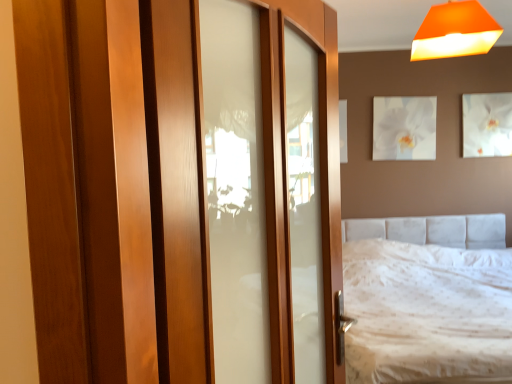
What do you see at coordinates (487, 124) in the screenshot? I see `white glossy picture frame at upper right, marked as the first picture frame in a right-to-left arrangement` at bounding box center [487, 124].

Locate an element on the screen. The width and height of the screenshot is (512, 384). white glossy picture frame at upper right, marked as the first picture frame in a right-to-left arrangement is located at coordinates (487, 124).

Describe the element at coordinates (115, 189) in the screenshot. The width and height of the screenshot is (512, 384). I see `wooden door at center` at that location.

What are the coordinates of `white glossy picture frame at upper center, the 1th picture frame when ordered from left to right` in the screenshot? It's located at (404, 128).

Which of these two, white textured bed at center or wooden door at center, is bigger?

white textured bed at center.

Is white textured bed at center far from wooden door at center?

That's right, there is a large distance between white textured bed at center and wooden door at center.

Does white textured bed at center have a greater height compared to wooden door at center?

Incorrect, the height of white textured bed at center is not larger of that of wooden door at center.

Between white textured bed at center and wooden door at center, which one has larger width?

With larger width is white textured bed at center.

Is white glossy picture frame at upper center, placed as the 2th picture frame when sorted from right to left, surrounded by orange matte lampshade at upper right?

No, orange matte lampshade at upper right does not contain white glossy picture frame at upper center, placed as the 2th picture frame when sorted from right to left.

In the scene shown: Is orange matte lampshade at upper right beside white glossy picture frame at upper center, placed as the 2th picture frame when sorted from right to left?

No, orange matte lampshade at upper right is not with white glossy picture frame at upper center, placed as the 2th picture frame when sorted from right to left.

Does orange matte lampshade at upper right have a lesser height compared to white glossy picture frame at upper center, placed as the 2th picture frame when sorted from right to left?

Correct, orange matte lampshade at upper right is not as tall as white glossy picture frame at upper center, placed as the 2th picture frame when sorted from right to left.

Which point is more distant from viewer, (431, 55) or (400, 117)?

The point (400, 117) is behind.

Which is closer, (382, 99) or (471, 27)?

Point (382, 99) is farther from the camera than point (471, 27).

From their relative heights in the image, would you say white glossy picture frame at upper center, placed as the 2th picture frame when sorted from right to left, is taller or shorter than orange matte lampshade at upper right?

white glossy picture frame at upper center, placed as the 2th picture frame when sorted from right to left, is taller than orange matte lampshade at upper right.

Is white glossy picture frame at upper center, the 1th picture frame when ordered from left to right, to the left or to the right of orange matte lampshade at upper right in the image?

In the image, white glossy picture frame at upper center, the 1th picture frame when ordered from left to right, appears on the right side of orange matte lampshade at upper right.

Can you confirm if white glossy picture frame at upper right, marked as the first picture frame in a right-to-left arrangement, is positioned to the right of orange matte lampshade at upper right?

Yes.

From the image's perspective, between white glossy picture frame at upper right, acting as the 2th picture frame starting from the left, and orange matte lampshade at upper right, which one is located above?

orange matte lampshade at upper right is shown above in the image.

Considering the positions of points (477, 146) and (458, 30), is point (477, 146) closer to camera compared to point (458, 30)?

No, it is not.

From a real-world perspective, is white glossy picture frame at upper right, acting as the 2th picture frame starting from the left, on orange matte lampshade at upper right?

Incorrect, from a real-world perspective, white glossy picture frame at upper right, acting as the 2th picture frame starting from the left, is lower than orange matte lampshade at upper right.

Is white glossy picture frame at upper right, acting as the 2th picture frame starting from the left, to the left of white textured bed at center from the viewer's perspective?

Incorrect, white glossy picture frame at upper right, acting as the 2th picture frame starting from the left, is not on the left side of white textured bed at center.

In the scene shown: Which is nearer, (465, 134) or (352, 265)?

Point (465, 134) is farther from the camera than point (352, 265).

Is the depth of white glossy picture frame at upper right, marked as the first picture frame in a right-to-left arrangement, less than that of white textured bed at center?

No, the depth of white glossy picture frame at upper right, marked as the first picture frame in a right-to-left arrangement, is greater than that of white textured bed at center.

Considering the sizes of white glossy picture frame at upper right, marked as the first picture frame in a right-to-left arrangement, and white textured bed at center in the image, is white glossy picture frame at upper right, marked as the first picture frame in a right-to-left arrangement, taller or shorter than white textured bed at center?

white glossy picture frame at upper right, marked as the first picture frame in a right-to-left arrangement, is shorter than white textured bed at center.

Between wooden door at center and white glossy picture frame at upper center, the 1th picture frame when ordered from left to right, which one has smaller size?

white glossy picture frame at upper center, the 1th picture frame when ordered from left to right, is smaller.

Looking at this image, is wooden door at center at the left side of white glossy picture frame at upper center, placed as the 2th picture frame when sorted from right to left?

Indeed, wooden door at center is positioned on the left side of white glossy picture frame at upper center, placed as the 2th picture frame when sorted from right to left.

From a real-world perspective, is wooden door at center physically located above or below white glossy picture frame at upper center, placed as the 2th picture frame when sorted from right to left?

Clearly, from a real-world perspective, wooden door at center is below white glossy picture frame at upper center, placed as the 2th picture frame when sorted from right to left.

Can you confirm if wooden door at center is taller than white glossy picture frame at upper center, placed as the 2th picture frame when sorted from right to left?

Correct, wooden door at center is much taller as white glossy picture frame at upper center, placed as the 2th picture frame when sorted from right to left.

Is orange matte lampshade at upper right directly adjacent to white glossy picture frame at upper right, acting as the 2th picture frame starting from the left?

They are not placed beside each other.

Could you measure the distance between orange matte lampshade at upper right and white glossy picture frame at upper right, acting as the 2th picture frame starting from the left?

orange matte lampshade at upper right is 6.40 feet away from white glossy picture frame at upper right, acting as the 2th picture frame starting from the left.

Can you confirm if orange matte lampshade at upper right is wider than white glossy picture frame at upper right, acting as the 2th picture frame starting from the left?

Indeed, orange matte lampshade at upper right has a greater width compared to white glossy picture frame at upper right, acting as the 2th picture frame starting from the left.

Who is smaller, orange matte lampshade at upper right or white glossy picture frame at upper right, marked as the first picture frame in a right-to-left arrangement?

Smaller between the two is white glossy picture frame at upper right, marked as the first picture frame in a right-to-left arrangement.

Locate an element on the screen. Image resolution: width=512 pixels, height=384 pixels. door located in front of the white textured bed at center is located at coordinates (115, 189).

I want to click on the 2nd picture frame behind when counting from the orange matte lampshade at upper right, so click(x=404, y=128).

Considering their positions, is white textured bed at center positioned further to wooden door at center than white glossy picture frame at upper center, the 1th picture frame when ordered from left to right?

Among the two, white glossy picture frame at upper center, the 1th picture frame when ordered from left to right, is located further to wooden door at center.

Considering their positions, is wooden door at center positioned closer to white glossy picture frame at upper right, acting as the 2th picture frame starting from the left, than white glossy picture frame at upper center, the 1th picture frame when ordered from left to right?

white glossy picture frame at upper center, the 1th picture frame when ordered from left to right.

Based on their spatial positions, is orange matte lampshade at upper right or white glossy picture frame at upper center, the 1th picture frame when ordered from left to right, closer to white glossy picture frame at upper right, acting as the 2th picture frame starting from the left?

Among the two, white glossy picture frame at upper center, the 1th picture frame when ordered from left to right, is located nearer to white glossy picture frame at upper right, acting as the 2th picture frame starting from the left.

Based on their spatial positions, is white textured bed at center or white glossy picture frame at upper right, acting as the 2th picture frame starting from the left, closer to wooden door at center?

white textured bed at center is closer to wooden door at center.

Which object lies further to the anchor point white glossy picture frame at upper center, the 1th picture frame when ordered from left to right, orange matte lampshade at upper right or white glossy picture frame at upper right, acting as the 2th picture frame starting from the left?

Based on the image, orange matte lampshade at upper right appears to be further to white glossy picture frame at upper center, the 1th picture frame when ordered from left to right.

When comparing their distances from white glossy picture frame at upper right, acting as the 2th picture frame starting from the left, does white glossy picture frame at upper center, the 1th picture frame when ordered from left to right, or orange matte lampshade at upper right seem further?

The object further to white glossy picture frame at upper right, acting as the 2th picture frame starting from the left, is orange matte lampshade at upper right.

When comparing their distances from white glossy picture frame at upper right, marked as the first picture frame in a right-to-left arrangement, does orange matte lampshade at upper right or white textured bed at center seem closer?

white textured bed at center is closer to white glossy picture frame at upper right, marked as the first picture frame in a right-to-left arrangement.

Based on their spatial positions, is white textured bed at center or orange matte lampshade at upper right closer to wooden door at center?

Based on the image, orange matte lampshade at upper right appears to be nearer to wooden door at center.

The width and height of the screenshot is (512, 384). Identify the location of picture frame between wooden door at center and white glossy picture frame at upper center, placed as the 2th picture frame when sorted from right to left, along the z-axis. (487, 124).

The height and width of the screenshot is (384, 512). Identify the location of lamp positioned between white textured bed at center and white glossy picture frame at upper center, the 1th picture frame when ordered from left to right, from near to far. (455, 31).

What are the coordinates of `lamp located between wooden door at center and white glossy picture frame at upper right, marked as the first picture frame in a right-to-left arrangement, in the depth direction` in the screenshot? It's located at (455, 31).

I want to click on door between orange matte lampshade at upper right and white textured bed at center vertically, so click(x=115, y=189).